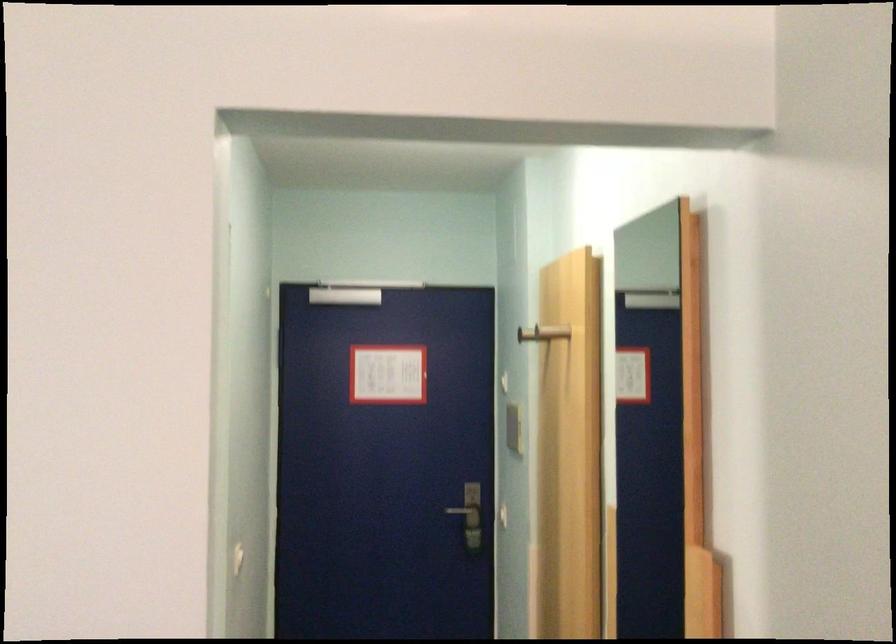
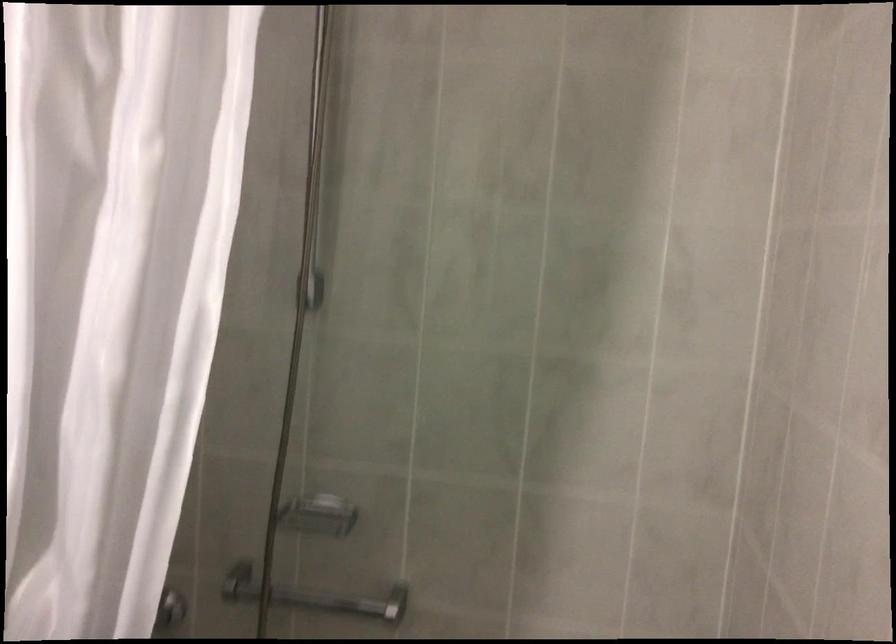
What movement of the cameraman would produce the second image?

The cameraman walked toward left, forward.